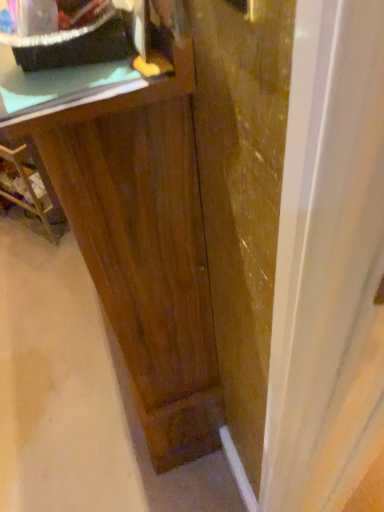
Identify the location of free spot to the left of dark wood vanity at center. (50, 328).